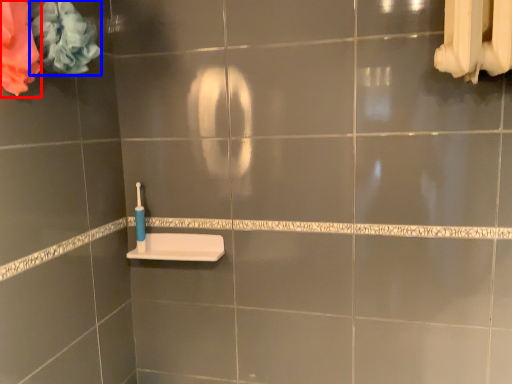
Question: Which object appears farthest to the camera in this image, flower (highlighted by a red box) or flower (highlighted by a blue box)?

Choices:
 (A) flower
 (B) flower

Answer: (B)